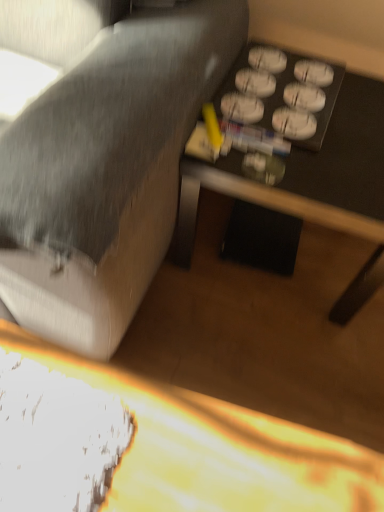
This screenshot has width=384, height=512. What are the coordinates of `black plastic table at lower right, the 2th table when ordered from bottom to top` in the screenshot? It's located at (303, 150).

Identify the location of textured gray fabric couch at center. (107, 172).

Between textured gray fabric couch at center and wooden table at center, which appears as the first table when ordered from the bottom, which one has smaller size?

Smaller between the two is wooden table at center, which appears as the first table when ordered from the bottom.

Based on their positions, is textured gray fabric couch at center located to the left or right of wooden table at center, which is the second table from top to bottom?

Clearly, textured gray fabric couch at center is on the left of wooden table at center, which is the second table from top to bottom, in the image.

Based on the photo, is textured gray fabric couch at center touching wooden table at center, which appears as the first table when ordered from the bottom?

textured gray fabric couch at center and wooden table at center, which appears as the first table when ordered from the bottom, are not in contact.

Looking at this image, which of these two, textured gray fabric couch at center or wooden table at center, which appears as the first table when ordered from the bottom, is thinner?

Thinner between the two is textured gray fabric couch at center.

Which is behind, point (318, 211) or point (89, 246)?

The point (318, 211) is more distant.

Is black plastic table at lower right, acting as the first table starting from the top, not within textured gray fabric couch at center?

Yes, black plastic table at lower right, acting as the first table starting from the top, is not within textured gray fabric couch at center.

Could you tell me if black plastic table at lower right, the 2th table when ordered from bottom to top, is facing textured gray fabric couch at center?

No.

Between black plastic table at lower right, the 2th table when ordered from bottom to top, and textured gray fabric couch at center, which one has more height?

With more height is textured gray fabric couch at center.

Considering the relative sizes of wooden table at center, which appears as the first table when ordered from the bottom, and textured gray fabric couch at center in the image provided, is wooden table at center, which appears as the first table when ordered from the bottom, wider than textured gray fabric couch at center?

Correct, the width of wooden table at center, which appears as the first table when ordered from the bottom, exceeds that of textured gray fabric couch at center.

Is textured gray fabric couch at center completely or partially inside wooden table at center, which is the second table from top to bottom?

Definitely not — textured gray fabric couch at center is not inside wooden table at center, which is the second table from top to bottom.

Is wooden table at center, which appears as the first table when ordered from the bottom, behind textured gray fabric couch at center?

Yes, wooden table at center, which appears as the first table when ordered from the bottom, is further from the viewer.

Does textured gray fabric couch at center turn towards black plastic table at lower right, the 2th table when ordered from bottom to top?

No, textured gray fabric couch at center does not turn towards black plastic table at lower right, the 2th table when ordered from bottom to top.

Considering the relative positions of textured gray fabric couch at center and black plastic table at lower right, acting as the first table starting from the top, in the image provided, is textured gray fabric couch at center to the left of black plastic table at lower right, acting as the first table starting from the top, from the viewer's perspective?

Indeed, textured gray fabric couch at center is positioned on the left side of black plastic table at lower right, acting as the first table starting from the top.

Is black plastic table at lower right, the 2th table when ordered from bottom to top, located within textured gray fabric couch at center?

No.

In the image, is textured gray fabric couch at center positioned in front of or behind black plastic table at lower right, the 2th table when ordered from bottom to top?

In the image, textured gray fabric couch at center appears in front of black plastic table at lower right, the 2th table when ordered from bottom to top.

Is black plastic table at lower right, the 2th table when ordered from bottom to top, oriented towards wooden table at center, which is the second table from top to bottom?

Yes, black plastic table at lower right, the 2th table when ordered from bottom to top, is aimed at wooden table at center, which is the second table from top to bottom.

Can we say black plastic table at lower right, acting as the first table starting from the top, lies outside wooden table at center, which appears as the first table when ordered from the bottom?

black plastic table at lower right, acting as the first table starting from the top, lies outside wooden table at center, which appears as the first table when ordered from the bottom,'s area.

Considering the sizes of objects black plastic table at lower right, the 2th table when ordered from bottom to top, and wooden table at center, which is the second table from top to bottom, in the image provided, who is wider, black plastic table at lower right, the 2th table when ordered from bottom to top, or wooden table at center, which is the second table from top to bottom,?

wooden table at center, which is the second table from top to bottom, is wider.

I want to click on table that is on the right side of wooden table at center, which is the second table from top to bottom, so click(x=303, y=150).

Based on their sizes in the image, would you say wooden table at center, which appears as the first table when ordered from the bottom, is bigger or smaller than black plastic table at lower right, the 2th table when ordered from bottom to top?

wooden table at center, which appears as the first table when ordered from the bottom, is smaller than black plastic table at lower right, the 2th table when ordered from bottom to top.

Between wooden table at center, which appears as the first table when ordered from the bottom, and black plastic table at lower right, the 2th table when ordered from bottom to top, which one has smaller width?

Thinner between the two is black plastic table at lower right, the 2th table when ordered from bottom to top.

The height and width of the screenshot is (512, 384). What are the coordinates of `table directly beneath the black plastic table at lower right, the 2th table when ordered from bottom to top (from a real-world perspective)` in the screenshot? It's located at (217, 449).

From the image's perspective, is wooden table at center, which appears as the first table when ordered from the bottom, on black plastic table at lower right, acting as the first table starting from the top?

No.

You are a GUI agent. You are given a task and a screenshot of the screen. Output one action in this format:
    pyautogui.click(x=<x>, y=<y>)
    Task: Click on the 1st table behind the textured gray fabric couch at center, starting your count from the anchor
    The image size is (384, 512).
    Given the screenshot: What is the action you would take?
    pyautogui.click(x=217, y=449)

From a real-world perspective, count 1st tables downward from the textured gray fabric couch at center and point to it. Please provide its 2D coordinates.

[(303, 150)]

Estimate the real-world distances between objects in this image. Which object is closer to black plastic table at lower right, acting as the first table starting from the top, wooden table at center, which appears as the first table when ordered from the bottom, or textured gray fabric couch at center?

The object closer to black plastic table at lower right, acting as the first table starting from the top, is textured gray fabric couch at center.

Considering their positions, is textured gray fabric couch at center positioned closer to black plastic table at lower right, the 2th table when ordered from bottom to top, than wooden table at center, which is the second table from top to bottom?

Among the two, textured gray fabric couch at center is located nearer to black plastic table at lower right, the 2th table when ordered from bottom to top.

Estimate the real-world distances between objects in this image. Which object is further from wooden table at center, which is the second table from top to bottom, textured gray fabric couch at center or black plastic table at lower right, the 2th table when ordered from bottom to top?

Among the two, black plastic table at lower right, the 2th table when ordered from bottom to top, is located further to wooden table at center, which is the second table from top to bottom.

Looking at the image, which one is located closer to textured gray fabric couch at center, wooden table at center, which is the second table from top to bottom, or black plastic table at lower right, the 2th table when ordered from bottom to top?

Among the two, black plastic table at lower right, the 2th table when ordered from bottom to top, is located nearer to textured gray fabric couch at center.

When comparing their distances from wooden table at center, which appears as the first table when ordered from the bottom, does black plastic table at lower right, the 2th table when ordered from bottom to top, or textured gray fabric couch at center seem closer?

textured gray fabric couch at center lies closer to wooden table at center, which appears as the first table when ordered from the bottom, than the other object.

Based on their spatial positions, is black plastic table at lower right, the 2th table when ordered from bottom to top, or wooden table at center, which is the second table from top to bottom, further from textured gray fabric couch at center?

wooden table at center, which is the second table from top to bottom, lies further to textured gray fabric couch at center than the other object.

Identify the location of table situated between textured gray fabric couch at center and black plastic table at lower right, the 2th table when ordered from bottom to top, from left to right. (217, 449).